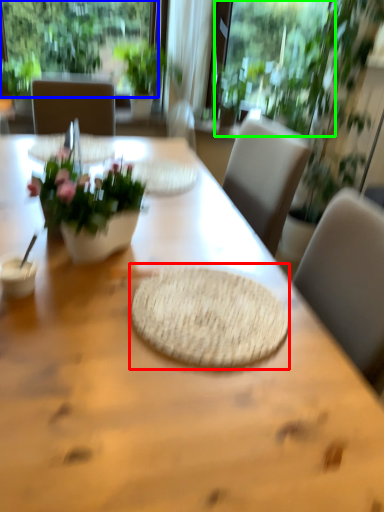
Question: Which is farther away from mat (highlighted by a red box)? window (highlighted by a blue box) or window screen (highlighted by a green box)?

Choices:
 (A) window
 (B) window screen

Answer: (A)